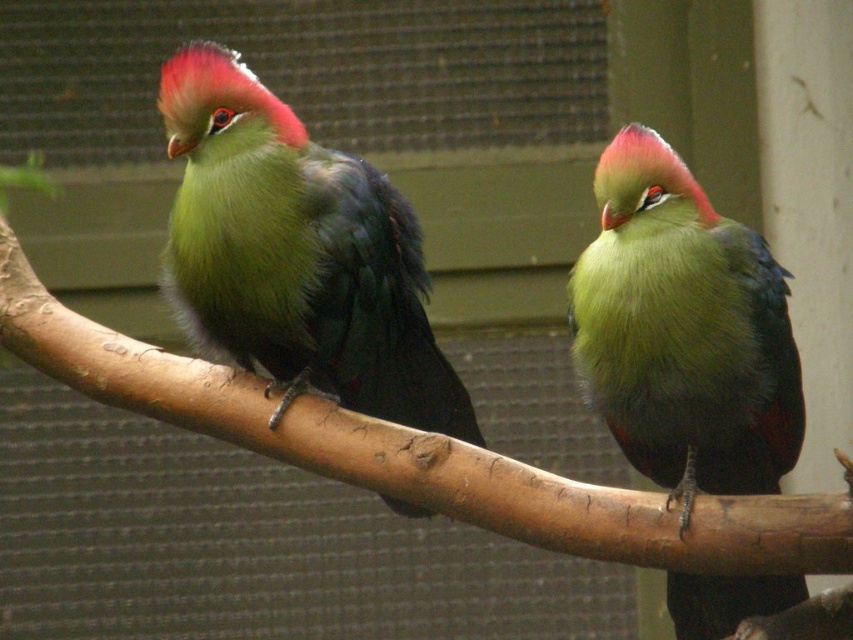
Who is more forward, (764, 611) or (659, 516)?

Point (659, 516)

Is green matte parrot at center below brown rough tree branch at center?

Incorrect, green matte parrot at center is not positioned below brown rough tree branch at center.

Is point (680, 177) positioned before point (229, 394)?

Yes, point (680, 177) is in front of point (229, 394).

Where is `green matte parrot at center`? green matte parrot at center is located at coordinates (683, 332).

Is lime green feathers at center closer to the viewer compared to brown rough tree branch at center?

No, lime green feathers at center is further to the viewer.

Is point (167, 244) behind point (90, 324)?

No, (167, 244) is in front of (90, 324).

Image resolution: width=853 pixels, height=640 pixels. What are the coordinates of `lime green feathers at center` in the screenshot? It's located at (296, 253).

Is point (187, 189) positioned before point (635, 436)?

No, it is not.

Image resolution: width=853 pixels, height=640 pixels. Find the location of `lime green feathers at center`. lime green feathers at center is located at coordinates (296, 253).

This screenshot has height=640, width=853. Find the location of `lime green feathers at center`. lime green feathers at center is located at coordinates (296, 253).